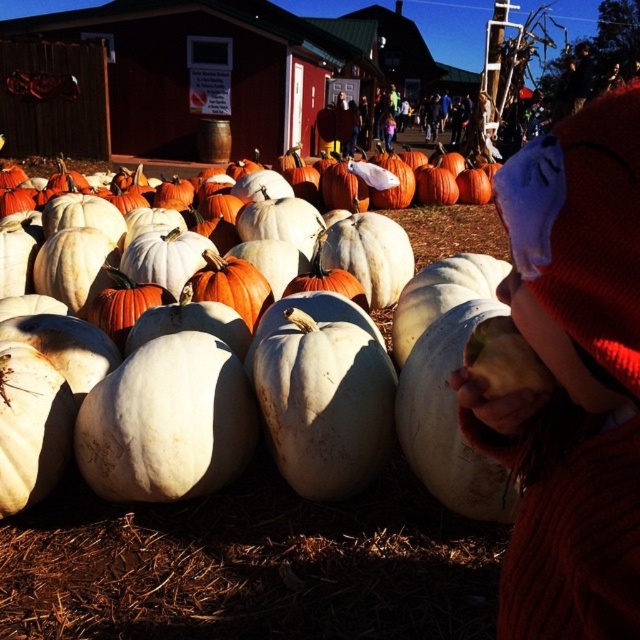
Question: From the image, what is the correct spatial relationship of red knit sweater at right in relation to white matte pumpkin at center?

Choices:
 (A) below
 (B) above

Answer: (A)

Question: From the image, what is the correct spatial relationship of red knit sweater at right in relation to white matte pumpkin at center?

Choices:
 (A) left
 (B) right

Answer: (B)

Question: Which of the following is the farthest from the observer?

Choices:
 (A) red knit sweater at right
 (B) white matte pumpkin at center

Answer: (B)

Question: Which object appears farthest from the camera in this image?

Choices:
 (A) red knit sweater at right
 (B) white matte pumpkin at center

Answer: (B)

Question: Does red knit sweater at right come in front of white matte pumpkin at center?

Choices:
 (A) yes
 (B) no

Answer: (A)

Question: Which object is closer to the camera taking this photo?

Choices:
 (A) red knit sweater at right
 (B) white matte pumpkin at center

Answer: (A)